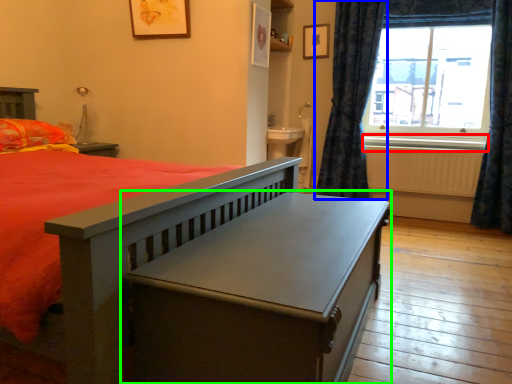
Question: Which object is positioned closest to window sill (highlighted by a red box)? Select from curtain (highlighted by a blue box) and table (highlighted by a green box).

Choices:
 (A) curtain
 (B) table

Answer: (A)